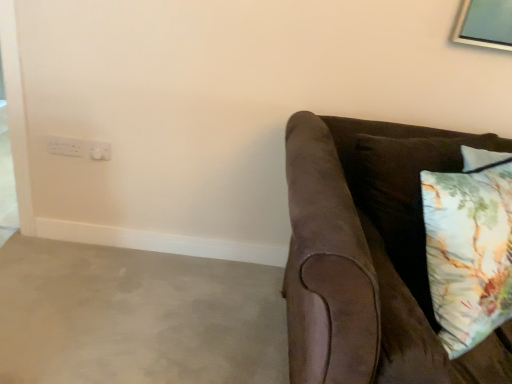
Question: Is suede brown couch at right at the right side of white plastic electric outlet at upper left, positioned as the second electric outlet in left-to-right order?

Choices:
 (A) no
 (B) yes

Answer: (B)

Question: Is suede brown couch at right facing away from white plastic electric outlet at upper left, positioned as the second electric outlet in left-to-right order?

Choices:
 (A) yes
 (B) no

Answer: (B)

Question: Considering the relative sizes of suede brown couch at right and white plastic electric outlet at upper left, the first electric outlet viewed from the right, in the image provided, is suede brown couch at right taller than white plastic electric outlet at upper left, the first electric outlet viewed from the right,?

Choices:
 (A) no
 (B) yes

Answer: (B)

Question: Is the position of suede brown couch at right less distant than that of white plastic electric outlet at upper left, positioned as the second electric outlet in left-to-right order?

Choices:
 (A) no
 (B) yes

Answer: (B)

Question: Considering the relative sizes of suede brown couch at right and white plastic electric outlet at upper left, positioned as the second electric outlet in left-to-right order, in the image provided, is suede brown couch at right smaller than white plastic electric outlet at upper left, positioned as the second electric outlet in left-to-right order,?

Choices:
 (A) no
 (B) yes

Answer: (A)

Question: Is white plastic electrical outlet at upper left, the second electric outlet viewed from the right, situated inside suede brown couch at right or outside?

Choices:
 (A) outside
 (B) inside

Answer: (A)

Question: Considering the positions of white plastic electrical outlet at upper left, the second electric outlet viewed from the right, and suede brown couch at right in the image, is white plastic electrical outlet at upper left, the second electric outlet viewed from the right, wider or thinner than suede brown couch at right?

Choices:
 (A) thin
 (B) wide

Answer: (A)

Question: Is point (77, 155) positioned closer to the camera than point (492, 342)?

Choices:
 (A) farther
 (B) closer

Answer: (A)

Question: In the image, is white plastic electrical outlet at upper left, the 1th electric outlet in the left-to-right sequence, positioned in front of or behind suede brown couch at right?

Choices:
 (A) behind
 (B) front

Answer: (A)

Question: Is point (494, 362) closer or farther from the camera than point (58, 140)?

Choices:
 (A) closer
 (B) farther

Answer: (A)

Question: Would you say suede brown couch at right is to the left or to the right of white plastic electrical outlet at upper left, the 1th electric outlet in the left-to-right sequence, in the picture?

Choices:
 (A) right
 (B) left

Answer: (A)

Question: Is suede brown couch at right inside the boundaries of white plastic electrical outlet at upper left, the 1th electric outlet in the left-to-right sequence, or outside?

Choices:
 (A) outside
 (B) inside

Answer: (A)

Question: Is suede brown couch at right taller or shorter than white plastic electrical outlet at upper left, the second electric outlet viewed from the right?

Choices:
 (A) tall
 (B) short

Answer: (A)

Question: Based on their positions, is white plastic electric outlet at upper left, the first electric outlet viewed from the right, located to the left or right of floral cotton pillow at right?

Choices:
 (A) left
 (B) right

Answer: (A)

Question: Considering the positions of white plastic electric outlet at upper left, the first electric outlet viewed from the right, and floral cotton pillow at right in the image, is white plastic electric outlet at upper left, the first electric outlet viewed from the right, wider or thinner than floral cotton pillow at right?

Choices:
 (A) wide
 (B) thin

Answer: (B)